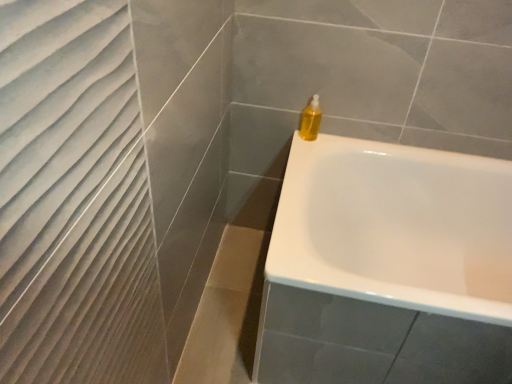
Locate an element on the screen. The width and height of the screenshot is (512, 384). free space to the right of translucent yellow liquid at upper right is located at coordinates (337, 136).